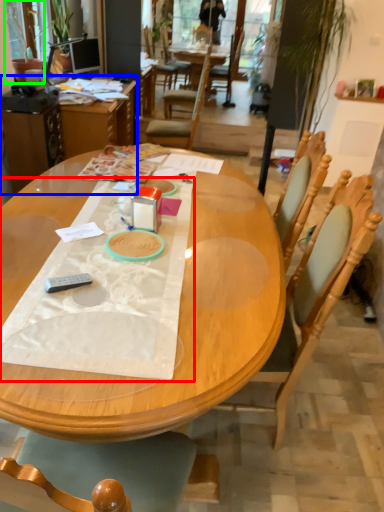
Question: Which is nearer to the sheet (highlighted by a red box)? table (highlighted by a blue box) or houseplant (highlighted by a green box).

Choices:
 (A) table
 (B) houseplant

Answer: (A)